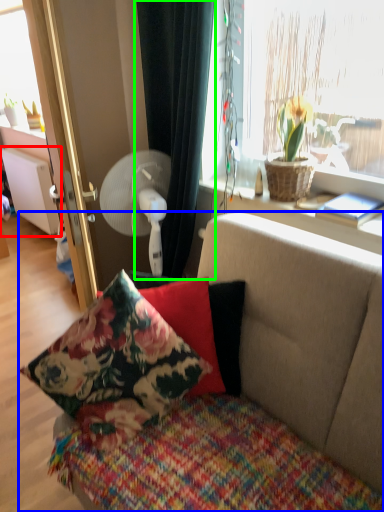
Question: Which object is the farthest from radiator (highlighted by a red box)? Choose among these: studio couch (highlighted by a blue box) or curtain (highlighted by a green box).

Choices:
 (A) studio couch
 (B) curtain

Answer: (A)